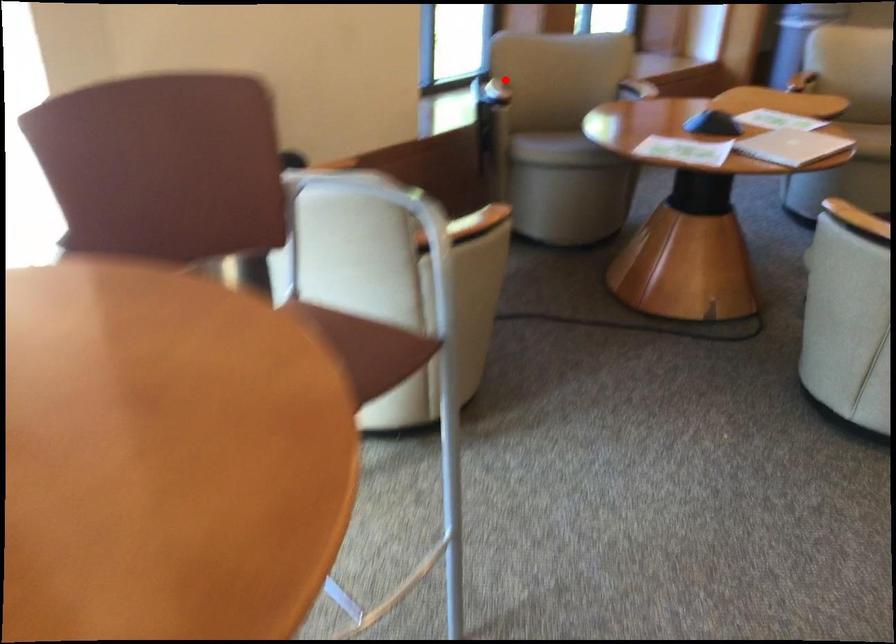
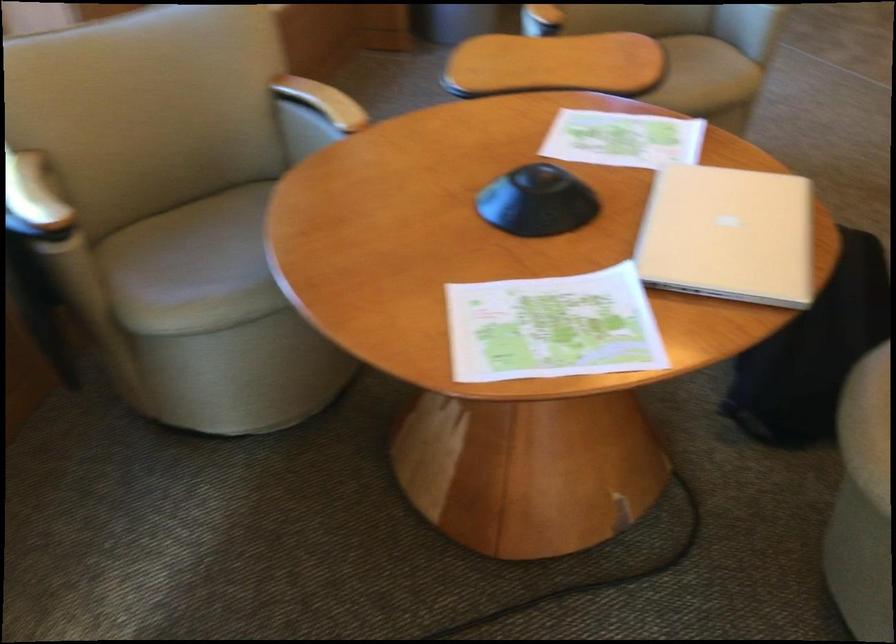
Question: I am providing you with two images of the same scene from different viewpoints. Given a red point in image1, look at the same physical point in image2. Is it:

Choices:
 (A) Closer to the viewpoint
 (B) Farther from the viewpoint

Answer: (A)